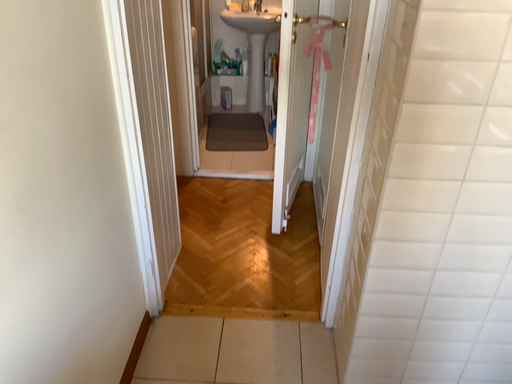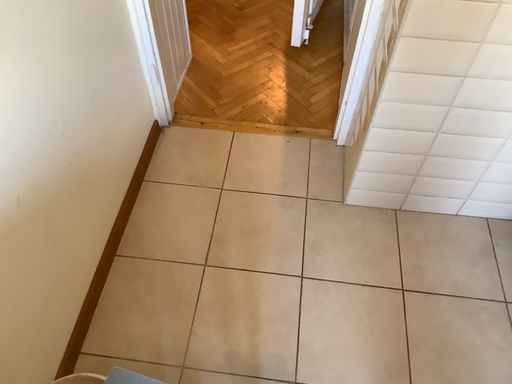
Question: How did the camera likely rotate when shooting the video?

Choices:
 (A) rotated upward
 (B) rotated downward

Answer: (B)